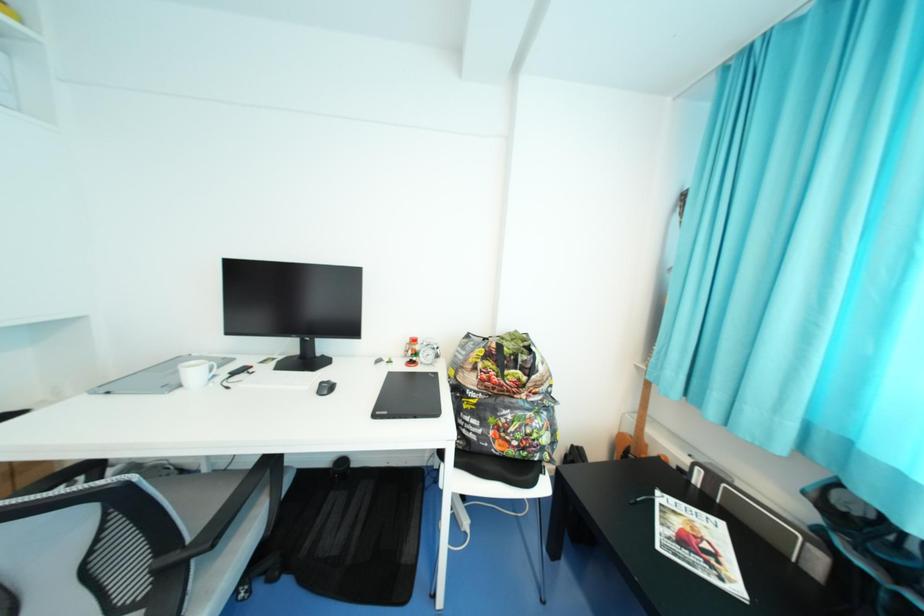
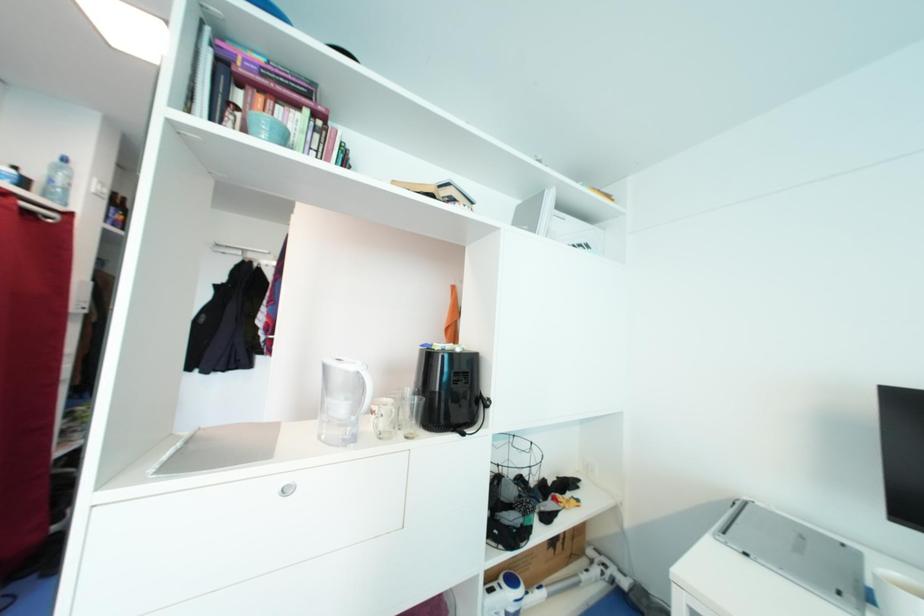
Question: The images are taken continuously from a first-person perspective. In which direction is your viewpoint rotating?

Choices:
 (A) Left
 (B) Right
 (C) Up
 (D) Down

Answer: (A)